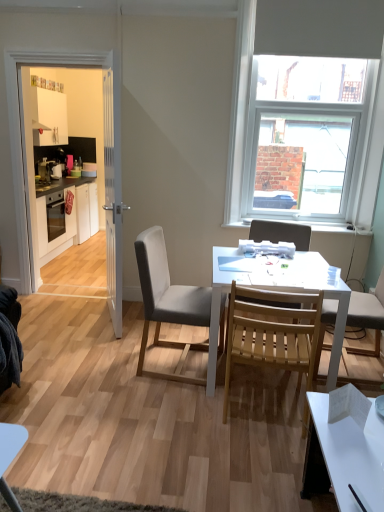
This screenshot has height=512, width=384. Describe the element at coordinates (272, 332) in the screenshot. I see `natural wood chair at center, positioned as the 2th chair in right-to-left order` at that location.

Identify the location of white glossy cabinets at left. The width and height of the screenshot is (384, 512). (67, 218).

Locate an element on the screen. The height and width of the screenshot is (512, 384). velvet grey chair at center, the third chair positioned from the right is located at coordinates (168, 301).

Locate an element on the screen. The height and width of the screenshot is (512, 384). white wooden door at left is located at coordinates (113, 191).

Is white glossy cabinets at left aimed at white glossy door at left?

No, white glossy cabinets at left is not oriented towards white glossy door at left.

I want to click on screen door in front of the white glossy cabinets at left, so click(x=105, y=155).

Considering the sizes of white glossy cabinets at left and white glossy door at left in the image, is white glossy cabinets at left taller or shorter than white glossy door at left?

Considering their sizes, white glossy cabinets at left has less height than white glossy door at left.

Is white glossy cabinets at left thinner than white glossy door at left?

In fact, white glossy cabinets at left might be wider than white glossy door at left.

Which is in front, point (52, 242) or point (43, 165)?

The point (43, 165) is in front.

From a real-world perspective, is white glossy cabinets at left positioned over metallic silver toaster at left based on gravity?

Incorrect, from a real-world perspective, white glossy cabinets at left is lower than metallic silver toaster at left.

Is white glossy cabinets at left outside of metallic silver toaster at left?

Yes, white glossy cabinets at left is located beyond the bounds of metallic silver toaster at left.

In the scene shown: Considering the relative sizes of white glossy cabinets at left and metallic silver toaster at left in the image provided, is white glossy cabinets at left thinner than metallic silver toaster at left?

No, white glossy cabinets at left is not thinner than metallic silver toaster at left.

Looking at this image, from a real-world perspective, is white wooden door at left above or below white glossy door at left?

white wooden door at left is below white glossy door at left.

Is white wooden door at left at the left side of white glossy door at left?

No, white wooden door at left is not to the left of white glossy door at left.

Is white wooden door at left spatially inside white glossy door at left, or outside of it?

white wooden door at left is outside white glossy door at left.

Consider the image. Could you tell me if white wooden door at left is facing white glossy door at left?

No.

How many degrees apart are the facing directions of white glossy door at left and white matte table at center?

The angular difference between white glossy door at left and white matte table at center is 88.8 degrees.

Is white glossy door at left next to white matte table at center and touching it?

No, white glossy door at left is not in contact with white matte table at center.

Measure the distance from white glossy door at left to white matte table at center.

white glossy door at left is 4.58 feet away from white matte table at center.

Is white glossy door at left bigger than white matte table at center?

Incorrect, white glossy door at left is not larger than white matte table at center.

Considering the sizes of objects white matte table at center and white glossy door at left in the image provided, who is smaller, white matte table at center or white glossy door at left?

With smaller size is white glossy door at left.

Is white matte table at center positioned far away from white glossy door at left?

Yes, white matte table at center is far from white glossy door at left.

Which is more to the left, white matte table at center or white glossy door at left?

Positioned to the left is white glossy door at left.

Is white matte table at center oriented towards white glossy door at left?

No, white matte table at center is not turned towards white glossy door at left.

Considering the sizes of objects white wooden door at left and white matte window at upper right in the image provided, who is taller, white wooden door at left or white matte window at upper right?

Standing taller between the two is white wooden door at left.

Can you confirm if white wooden door at left is bigger than white matte window at upper right?

Incorrect, white wooden door at left is not larger than white matte window at upper right.

Consider the image. Could you tell me if white wooden door at left is facing white matte window at upper right?

No, white wooden door at left is not turned towards white matte window at upper right.

Considering the points (113, 204) and (273, 32), which point is behind, point (113, 204) or point (273, 32)?

The point (273, 32) is farther from the camera.

Is white glossy cabinets at left thinner than white matte window at upper right?

In fact, white glossy cabinets at left might be wider than white matte window at upper right.

From a real-world perspective, who is located higher, white glossy cabinets at left or white matte window at upper right?

In real-world perspective, white matte window at upper right is above.

Can you confirm if white glossy cabinets at left is taller than white matte window at upper right?

Incorrect, the height of white glossy cabinets at left is not larger of that of white matte window at upper right.

From the image's perspective, between white glossy cabinets at left and white matte window at upper right, who is located below?

white glossy cabinets at left.

The image size is (384, 512). I want to click on screen door on the right of the white glossy cabinets at left, so click(x=105, y=155).

Identify the location of appliance positioned vertically above the white glossy cabinets at left (from a real-world perspective). coord(45,169).

Which object lies nearer to the anchor point metallic silver toaster at left, white glossy cabinets at left or white matte window at upper right?

Among the two, white glossy cabinets at left is located nearer to metallic silver toaster at left.

Based on their spatial positions, is natural wood chair at center, the 2th chair when ordered from left to right, or white matte window at upper right further from white glossy door at left?

natural wood chair at center, the 2th chair when ordered from left to right, lies further to white glossy door at left than the other object.

When comparing their distances from white glossy cabinets at left, does white wooden door at left or white matte window at upper right seem further?

The object further to white glossy cabinets at left is white matte window at upper right.

Based on the photo, based on their spatial positions, is white glossy cabinets at left or white matte table at center closer to velvet grey chair at center, which is the first chair in left-to-right order?

Among the two, white matte table at center is located nearer to velvet grey chair at center, which is the first chair in left-to-right order.

Considering their positions, is metallic silver toaster at left positioned closer to white wooden door at left than white glossy door at left?

white glossy door at left.

Estimate the real-world distances between objects in this image. Which object is closer to white glossy door at left, white wooden door at left or white matte table at center?

white wooden door at left.

Estimate the real-world distances between objects in this image. Which object is further from velvet grey chair at center, the third chair positioned from the right, white glossy cabinets at left or wooden slats chair at center, the first chair viewed from the right?

Based on the image, white glossy cabinets at left appears to be further to velvet grey chair at center, the third chair positioned from the right.

Considering their positions, is wooden slats chair at center, the first chair viewed from the right, positioned further to white wooden door at left than natural wood chair at center, the 2th chair when ordered from left to right?

natural wood chair at center, the 2th chair when ordered from left to right, is further to white wooden door at left.

I want to click on door between white glossy door at left and natural wood chair at center, positioned as the 2th chair in right-to-left order, in the horizontal direction, so click(113, 191).

I want to click on screen door between white wooden door at left and white glossy cabinets at left from front to back, so click(x=105, y=155).

This screenshot has width=384, height=512. I want to click on chair between velvet grey chair at center, the third chair positioned from the right, and metallic silver toaster at left, along the z-axis, so click(x=281, y=233).

Locate an element on the screen. This screenshot has height=512, width=384. screen door between wooden slats chair at center, the first chair viewed from the right, and metallic silver toaster at left, along the z-axis is located at coordinates (105, 155).